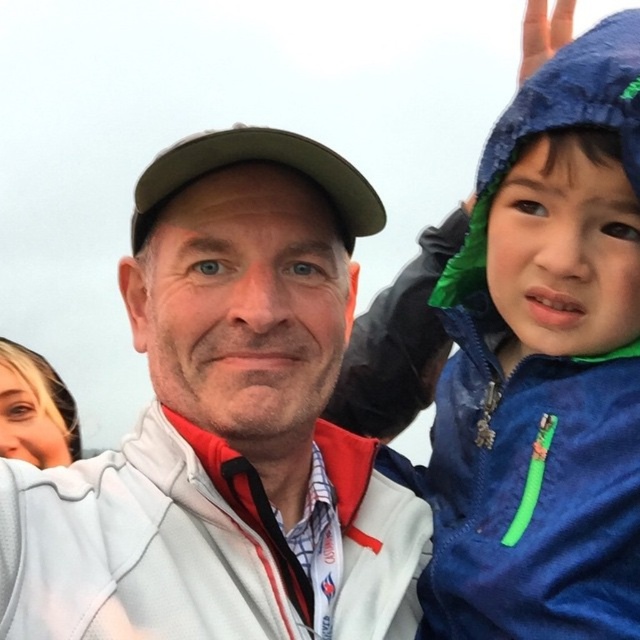
Does white fleece jacket at center have a larger size compared to blue fleece jacket at upper right?

Indeed, white fleece jacket at center has a larger size compared to blue fleece jacket at upper right.

Does white fleece jacket at center have a lesser width compared to blue fleece jacket at upper right?

No, white fleece jacket at center is not thinner than blue fleece jacket at upper right.

Describe the element at coordinates (227, 426) in the screenshot. The height and width of the screenshot is (640, 640). I see `white fleece jacket at center` at that location.

You are a GUI agent. You are given a task and a screenshot of the screen. Output one action in this format:
    pyautogui.click(x=<x>, y=<y>)
    Task: Click on the white fleece jacket at center
    The height and width of the screenshot is (640, 640).
    Given the screenshot: What is the action you would take?
    227,426